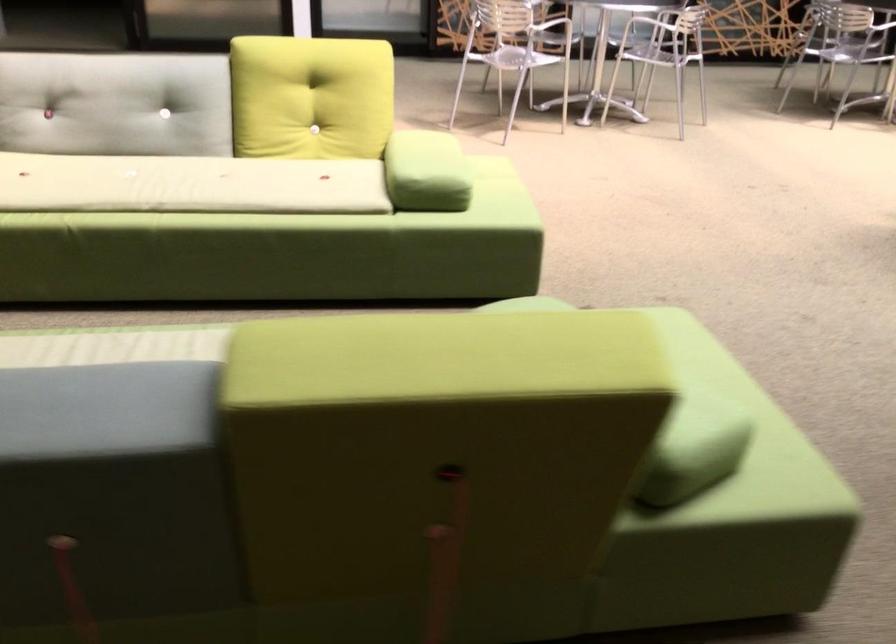
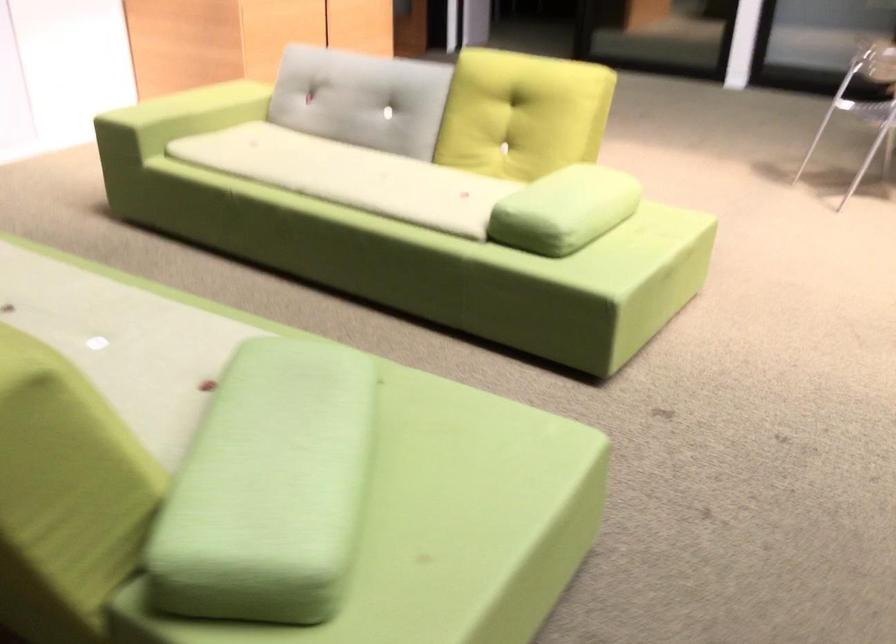
Where in the second image is the point corresponding to point (126, 104) from the first image?

(362, 99)